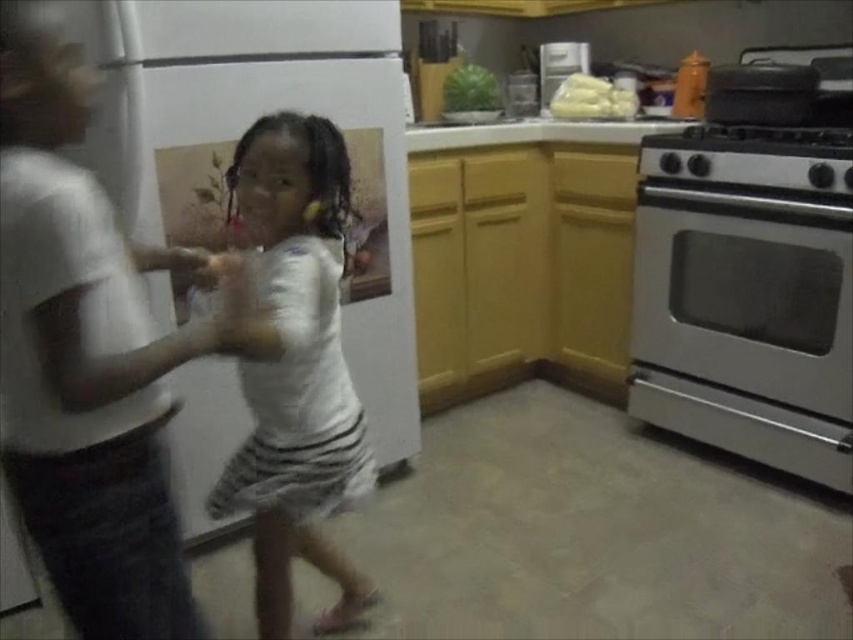
You are organizing a laundry day and need to sort the white matte shirt at left and the white cotton shirt at center. According to their positions in the image, which shirt is closer to the left side of the kitchen?

The white matte shirt at left is closer to the left side of the kitchen as it is positioned to the left of the white cotton shirt at center.

You are a photographer adjusting your camera settings in the kitchen scene. You need to focus on two specific points marked as point 1 at (846, 177) and point 2 at (585, 61). Which point should you focus on first to ensure proper depth of field?

Point 1 at (846, 177) is closer to the camera than point 2 at (585, 61), so you should focus on point 1 first to ensure proper depth of field.